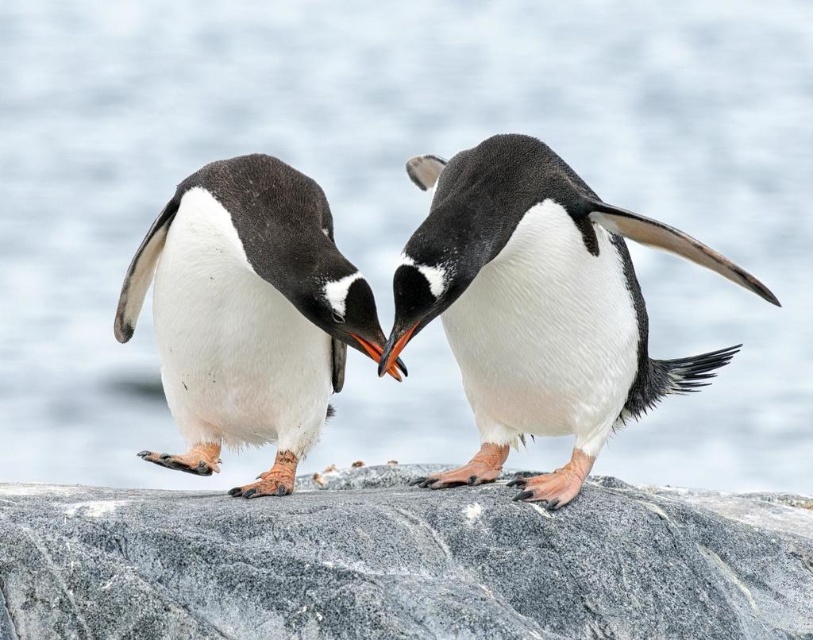
Is point (583, 634) closer to viewer compared to point (233, 496)?

Yes, it is.

From the picture: Can you confirm if granite rock at center is positioned to the right of white fluffy penguin at center?

Correct, you'll find granite rock at center to the right of white fluffy penguin at center.

Between point (641, 522) and point (157, 321), which one is positioned in front?

Positioned in front is point (641, 522).

Identify the location of granite rock at center. (402, 563).

Between white matte penguin at center and white fluffy penguin at center, which one has less height?

With less height is white fluffy penguin at center.

Is white matte penguin at center to the right of white fluffy penguin at center from the viewer's perspective?

Indeed, white matte penguin at center is positioned on the right side of white fluffy penguin at center.

Find the location of a particular element. The image size is (813, 640). white matte penguin at center is located at coordinates (538, 305).

How distant is granite rock at center from white matte penguin at center?

The distance of granite rock at center from white matte penguin at center is 35.31 centimeters.

Does granite rock at center have a smaller size compared to white matte penguin at center?

No, granite rock at center is not smaller than white matte penguin at center.

Is point (225, 568) more distant than point (505, 324)?

No, (225, 568) is in front of (505, 324).

The width and height of the screenshot is (813, 640). Identify the location of granite rock at center. (x=402, y=563).